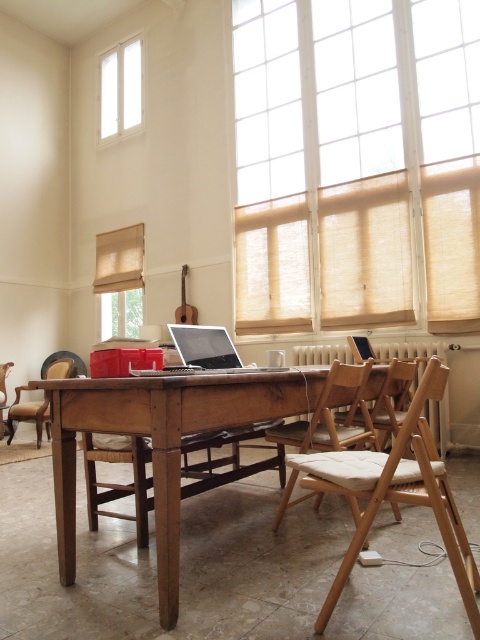
You are sitting in the wooden armchair at lower left and want to look out the beige fabric window at upper right. Can you see the window without moving your chair?

The beige fabric window at upper right is in front of the wooden armchair at lower left, so yes, you can see the window without moving your chair.